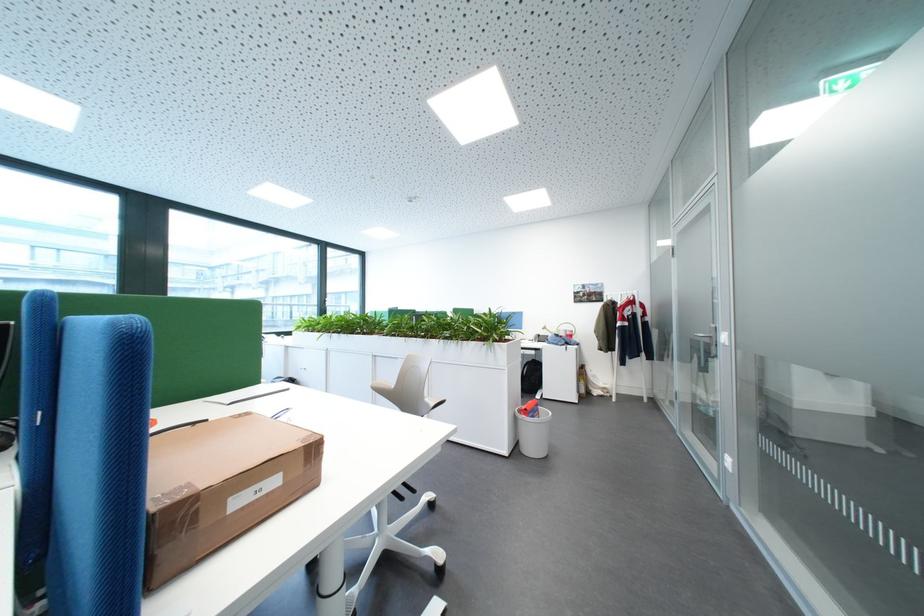
The location [220,485] corresponds to which object?

It refers to a brown cardboard box.